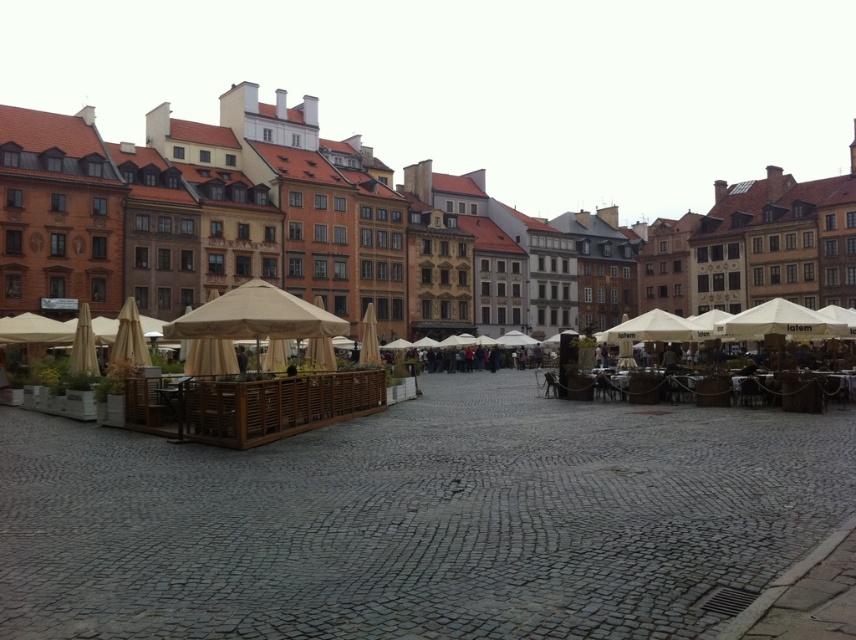
Where is `white fabric canopy at right`? This screenshot has width=856, height=640. white fabric canopy at right is located at coordinates (780, 321).

Is point (776, 301) less distant than point (645, 317)?

Yes.

Identify the location of white fabric canopy at right. The height and width of the screenshot is (640, 856). (780, 321).

Which is above, beige fabric canopy at center or white fabric canopy at right?

beige fabric canopy at center is above.

Between point (192, 310) and point (825, 326), which one is positioned in front?

Point (825, 326) is more forward.

Find the location of `beige fabric canopy at center`. beige fabric canopy at center is located at coordinates (254, 316).

Looking at this image, can you confirm if beige fabric canopy at center is positioned to the right of white fabric canopy at center?

No, beige fabric canopy at center is not to the right of white fabric canopy at center.

Does beige fabric canopy at center appear on the left side of white fabric canopy at center?

Indeed, beige fabric canopy at center is positioned on the left side of white fabric canopy at center.

Is point (247, 324) closer to camera compared to point (642, 317)?

Yes, point (247, 324) is in front of point (642, 317).

Find the location of `beige fabric canopy at center`. beige fabric canopy at center is located at coordinates (254, 316).